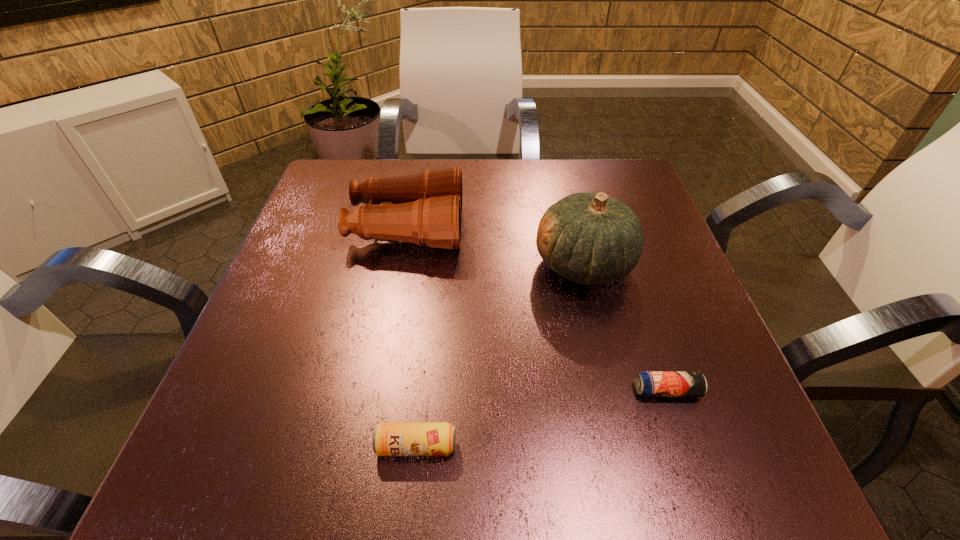
At what (x,y) coordinates should I click in order to perform the action: click on the tallest object. Please return your answer as a coordinate pair (x, y). Looking at the image, I should click on pyautogui.click(x=592, y=239).

Find the location of a particular element. the third shortest object is located at coordinates (426, 208).

I want to click on the nearer beer can, so click(x=389, y=438).

Locate an element on the screen. the left beer can is located at coordinates (389, 438).

At what (x,y) coordinates should I click in order to perform the action: click on the third farthest object. Please return your answer as a coordinate pair (x, y). This screenshot has width=960, height=540. Looking at the image, I should click on (648, 383).

Where is `the right beer can`? The image size is (960, 540). the right beer can is located at coordinates (648, 383).

At what (x,y) coordinates should I click in order to perform the action: click on vacant space located 0.250m on the back of the gourd. Please return your answer as a coordinate pair (x, y). The height and width of the screenshot is (540, 960). Looking at the image, I should click on coord(562,172).

Identify the location of free location located 0.300m through the lenses of the binoculars. (594, 228).

Locate an element on the screen. vacant area situated 0.120m on the back of the left beer can is located at coordinates (425, 363).

Where is `free space located on the front of the third farthest object`? free space located on the front of the third farthest object is located at coordinates (692, 467).